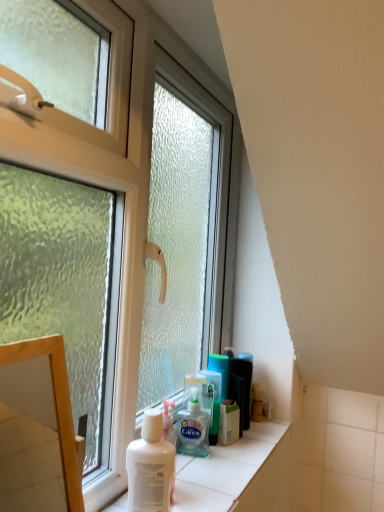
Question: Considering the relative sizes of transparent glass window at center and translucent plastic shaving cream at lower center, positioned as the 2th shaving cream in front-to-back order, in the image provided, is transparent glass window at center bigger than translucent plastic shaving cream at lower center, positioned as the 2th shaving cream in front-to-back order,?

Choices:
 (A) no
 (B) yes

Answer: (B)

Question: Considering the relative sizes of transparent glass window at center and translucent plastic shaving cream at lower center, the first shaving cream viewed from the back, in the image provided, is transparent glass window at center shorter than translucent plastic shaving cream at lower center, the first shaving cream viewed from the back,?

Choices:
 (A) no
 (B) yes

Answer: (A)

Question: Can you see transparent glass window at center touching translucent plastic shaving cream at lower center, the first shaving cream viewed from the back?

Choices:
 (A) no
 (B) yes

Answer: (A)

Question: Does transparent glass window at center have a smaller size compared to translucent plastic shaving cream at lower center, positioned as the 2th shaving cream in front-to-back order?

Choices:
 (A) yes
 (B) no

Answer: (B)

Question: Is transparent glass window at center facing away from translucent plastic shaving cream at lower center, positioned as the 2th shaving cream in front-to-back order?

Choices:
 (A) yes
 (B) no

Answer: (A)

Question: Is transparent glass window at center oriented towards translucent plastic shaving cream at lower center, positioned as the 2th shaving cream in front-to-back order?

Choices:
 (A) yes
 (B) no

Answer: (A)

Question: Is transparent glass window at center located within translucent plastic shaving cream at lower center, positioned as the 2th shaving cream in front-to-back order?

Choices:
 (A) no
 (B) yes

Answer: (A)

Question: Is translucent plastic shaving cream at lower center, the first shaving cream viewed from the back, bigger than transparent glass window at center?

Choices:
 (A) yes
 (B) no

Answer: (B)

Question: From the image's perspective, is translucent plastic shaving cream at lower center, the first shaving cream viewed from the back, on transparent glass window at center?

Choices:
 (A) yes
 (B) no

Answer: (B)

Question: Is translucent plastic shaving cream at lower center, positioned as the 2th shaving cream in front-to-back order, positioned in front of transparent glass window at center?

Choices:
 (A) no
 (B) yes

Answer: (A)

Question: Considering the relative sizes of translucent plastic shaving cream at lower center, positioned as the 2th shaving cream in front-to-back order, and transparent glass window at center in the image provided, is translucent plastic shaving cream at lower center, positioned as the 2th shaving cream in front-to-back order, taller than transparent glass window at center?

Choices:
 (A) no
 (B) yes

Answer: (A)

Question: From the image's perspective, is translucent plastic shaving cream at lower center, positioned as the 2th shaving cream in front-to-back order, below transparent glass window at center?

Choices:
 (A) no
 (B) yes

Answer: (B)

Question: Does wooden frame at left turn towards translucent plastic shaving cream at lower center, the first shaving cream viewed from the back?

Choices:
 (A) no
 (B) yes

Answer: (A)